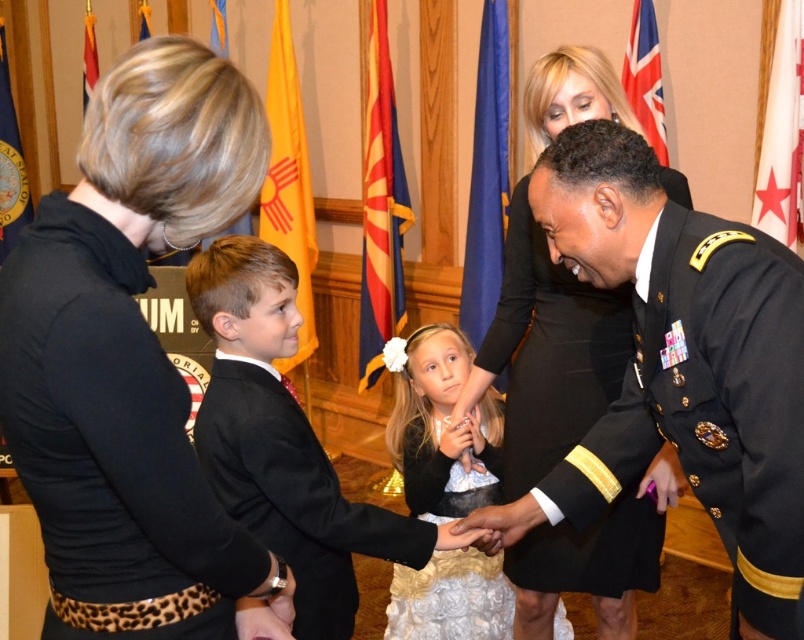
Looking at this image, is black satin suit at left to the right of white satin dress at center from the viewer's perspective?

Incorrect, black satin suit at left is not on the right side of white satin dress at center.

Is black satin suit at left in front of white satin dress at center?

Yes.

This screenshot has width=804, height=640. Identify the location of black satin suit at left. (109, 440).

Where is `black satin suit at left`? This screenshot has width=804, height=640. black satin suit at left is located at coordinates (109, 440).

Does black satin suit at left have a greater width compared to black satin suit at center?

No, black satin suit at left is not wider than black satin suit at center.

Between black satin suit at left and black satin suit at center, which one appears on the left side from the viewer's perspective?

black satin suit at left

Locate an element on the screen. The height and width of the screenshot is (640, 804). black satin suit at left is located at coordinates (109, 440).

Is the position of black satin suit at left more distant than that of black dress at center?

No.

Who is more distant from viewer, (68,365) or (626,328)?

Point (626,328)

Who is more distant from viewer, (133, 355) or (624, 600)?

The point (624, 600) is more distant.

The image size is (804, 640). What are the coordinates of `black satin suit at left` in the screenshot? It's located at (109, 440).